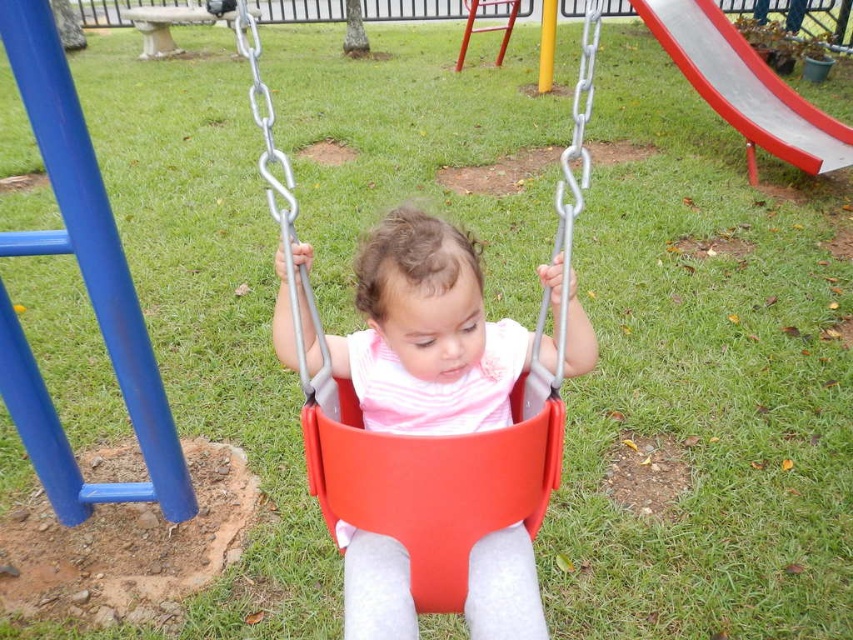
You are a parent trying to decide which playground equipment is safer for your child based on their height. The matte plastic swing at center and the smooth plastic slide at upper right are options. According to the image, which one is shorter and therefore more appropriate for a smaller child?

The matte plastic swing at center is shorter than the smooth plastic slide at upper right, so it is more appropriate for a smaller child.

You are a parent at the playground and want to ensure your child can move from the matte plastic swing at center to the smooth plastic slide at upper right safely. Based on their positions, which direction should you guide the child to walk towards the slide?

The matte plastic swing at center is positioned on the left side of the smooth plastic slide at upper right, so the child should walk towards the right to reach the slide.